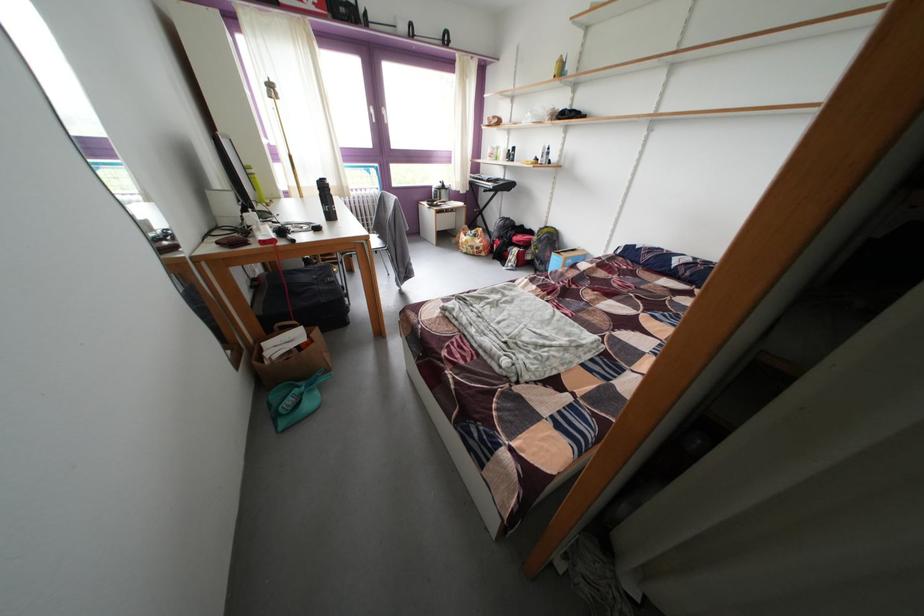
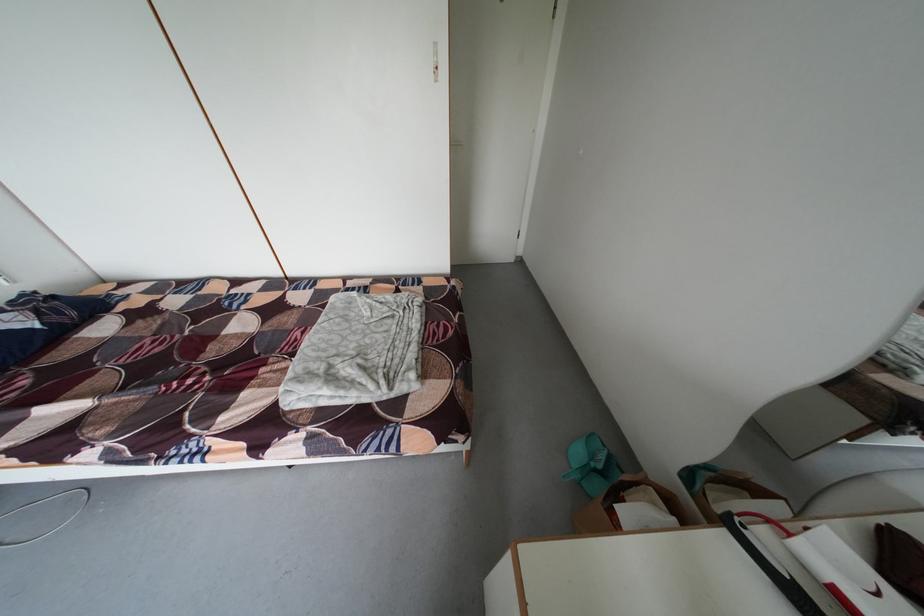
Where in the second image is the point corresponding to pixel 578 318 from the first image?

(309, 339)